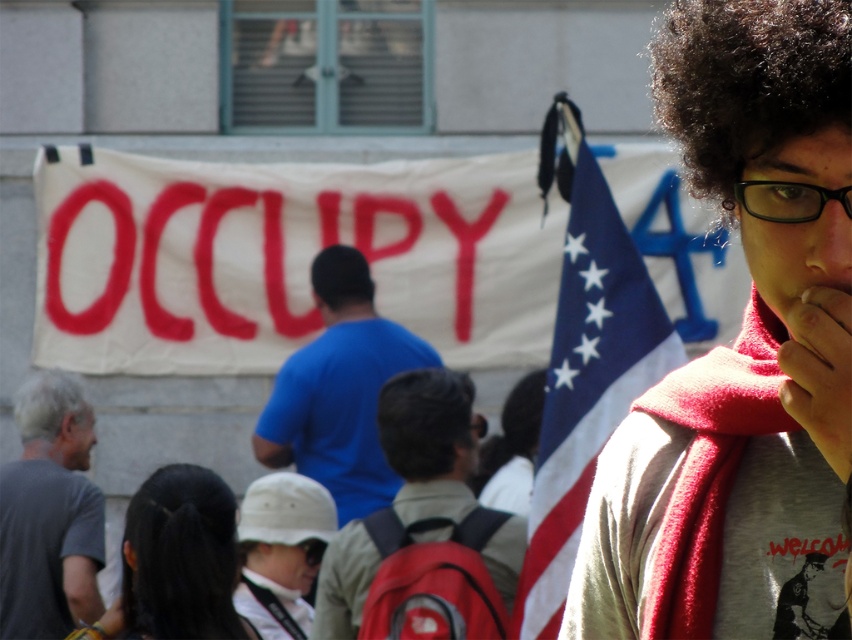
You are a photographer trying to capture a closeup of the pink matte nose at center and the gray matte afro at lower left. Which object would require a wider angle lens to ensure both are fully in frame?

The gray matte afro at lower left requires a wider angle lens because it is wider than the pink matte nose at center.

You are a photographer standing at the edge of the crowd. You want to take a photo that includes both the black silky hair at lower center and the pink matte nose at center. Given that your camera has a maximum focus range of 5 meters, will you be able to capture both subjects in focus?

The distance between the black silky hair at lower center and the pink matte nose at center is 5.98 meters, which exceeds the camera maximum focus range of 5 meters. Therefore, you cannot capture both subjects in focus.

You are a photographer trying to capture a clear shot of the protest. You notice the red backpack at center and the black matte afro at center are blocking your view. Which object is taller and might be more obstructive?

The red backpack at center is taller than the black matte afro at center, so it might be more obstructive.